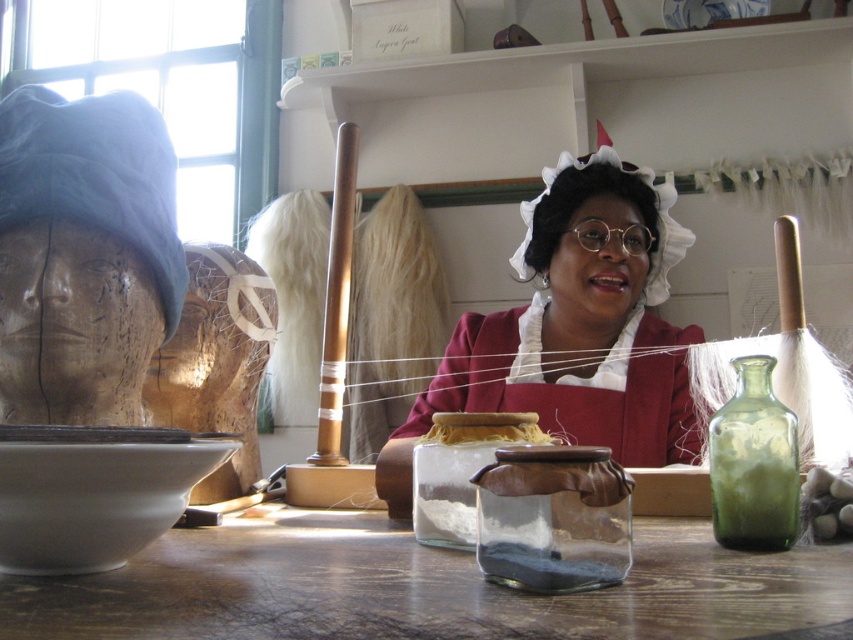
Question: Which of the following is the closest to the observer?

Choices:
 (A) (550, 436)
 (B) (471, 573)

Answer: (B)

Question: Which point appears closest to the camera in this image?

Choices:
 (A) (51, 492)
 (B) (268, 548)

Answer: (A)

Question: Is white glossy bowl at lower left behind green glass bottle at right?

Choices:
 (A) yes
 (B) no

Answer: (B)

Question: Can you confirm if transparent glass jar at center is smaller than yellow string at center?

Choices:
 (A) yes
 (B) no

Answer: (B)

Question: Does transparent glass jar at center have a larger size compared to green glass bottle at right?

Choices:
 (A) yes
 (B) no

Answer: (A)

Question: Which of these objects is positioned farthest from the yellow string at center?

Choices:
 (A) white glossy bowl at lower left
 (B) green glass bottle at right

Answer: (A)